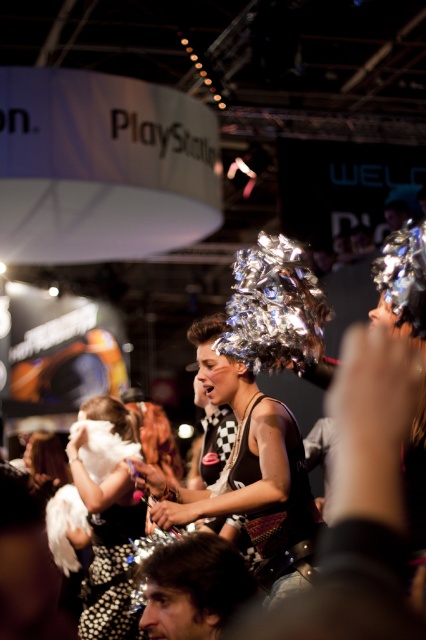
Who is lower down, shiny metallic pom-pom at center or white fluffy wings at center?

Positioned lower is white fluffy wings at center.

Locate an element on the screen. This screenshot has height=640, width=426. shiny metallic pom-pom at center is located at coordinates (249, 472).

This screenshot has height=640, width=426. What are the coordinates of `shiny metallic pom-pom at center` in the screenshot? It's located at (249, 472).

Describe the element at coordinates (249, 472) in the screenshot. I see `shiny metallic pom-pom at center` at that location.

Consider the image. Who is higher up, shiny metallic pom-pom at center or dark brown hair at lower left?

shiny metallic pom-pom at center is above.

The height and width of the screenshot is (640, 426). Identify the location of shiny metallic pom-pom at center. (249, 472).

At what (x,y) coordinates should I click in order to perform the action: click on shiny metallic pom-pom at center. Please return your answer as a coordinate pair (x, y). The width and height of the screenshot is (426, 640). Looking at the image, I should click on (249, 472).

Is white fluffy wings at center shorter than dark brown hair at lower left?

In fact, white fluffy wings at center may be taller than dark brown hair at lower left.

Does white fluffy wings at center come behind dark brown hair at lower left?

Yes, white fluffy wings at center is further from the viewer.

Find the location of a particular element. white fluffy wings at center is located at coordinates (108, 547).

The image size is (426, 640). Identify the location of white fluffy wings at center. (x=108, y=547).